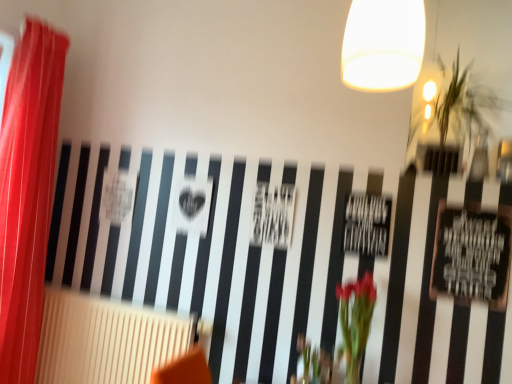
Question: Does red sheer curtain at left have a smaller size compared to green leafy vase at center?

Choices:
 (A) no
 (B) yes

Answer: (A)

Question: Is red sheer curtain at left to the right of green leafy vase at center from the viewer's perspective?

Choices:
 (A) no
 (B) yes

Answer: (A)

Question: Is there a large distance between red sheer curtain at left and green leafy vase at center?

Choices:
 (A) no
 (B) yes

Answer: (B)

Question: Is red sheer curtain at left facing away from green leafy vase at center?

Choices:
 (A) yes
 (B) no

Answer: (B)

Question: Does red sheer curtain at left turn towards green leafy vase at center?

Choices:
 (A) yes
 (B) no

Answer: (A)

Question: From their relative heights in the image, would you say green leafy vase at center is taller or shorter than beige textured radiator at lower left?

Choices:
 (A) tall
 (B) short

Answer: (B)

Question: In terms of size, does green leafy vase at center appear bigger or smaller than beige textured radiator at lower left?

Choices:
 (A) big
 (B) small

Answer: (B)

Question: Is green leafy vase at center in front of or behind beige textured radiator at lower left in the image?

Choices:
 (A) behind
 (B) front

Answer: (B)

Question: Would you say green leafy vase at center is inside or outside beige textured radiator at lower left?

Choices:
 (A) inside
 (B) outside

Answer: (B)

Question: Is point (433, 114) positioned closer to the camera than point (2, 190)?

Choices:
 (A) closer
 (B) farther

Answer: (B)

Question: Looking at their shapes, would you say green leafy plant at upper right is wider or thinner than red sheer curtain at left?

Choices:
 (A) wide
 (B) thin

Answer: (A)

Question: Is green leafy plant at upper right in front of or behind red sheer curtain at left in the image?

Choices:
 (A) behind
 (B) front

Answer: (B)

Question: Based on their positions, is green leafy plant at upper right located to the left or right of red sheer curtain at left?

Choices:
 (A) right
 (B) left

Answer: (A)

Question: Does point (33, 205) appear closer or farther from the camera than point (356, 340)?

Choices:
 (A) closer
 (B) farther

Answer: (B)

Question: Choose the correct answer: Is red sheer curtain at left inside green leafy vase at center or outside it?

Choices:
 (A) inside
 (B) outside

Answer: (B)